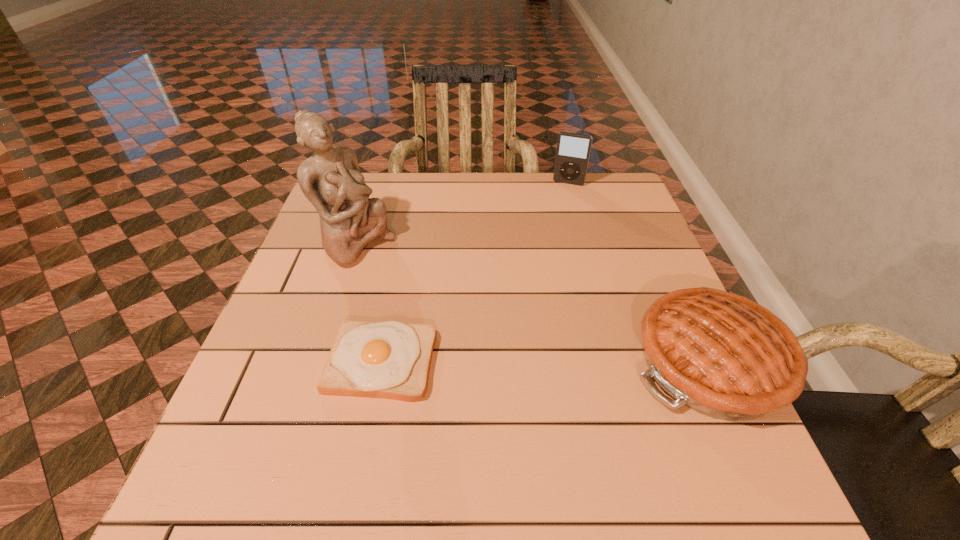
The image size is (960, 540). In order to click on toast in this screenshot , I will do (391, 359).

This screenshot has width=960, height=540. Identify the location of pie. (721, 354).

Locate an element on the screen. The height and width of the screenshot is (540, 960). the third nearest object is located at coordinates (331, 180).

Locate an element on the screen. Image resolution: width=960 pixels, height=540 pixels. figurine is located at coordinates (331, 180).

Locate an element on the screen. Image resolution: width=960 pixels, height=540 pixels. the third shortest object is located at coordinates (573, 150).

Locate an element on the screen. the farthest object is located at coordinates click(573, 150).

Locate an element on the screen. This screenshot has width=960, height=540. free space located 0.370m on the right of the shortest object is located at coordinates (623, 362).

At what (x,y) coordinates should I click in order to perform the action: click on blank space located 0.170m on the left of the third tallest object. Please return your answer as a coordinate pair (x, y). The image size is (960, 540). Looking at the image, I should click on (544, 362).

Find the location of a particular element. Image resolution: width=960 pixels, height=540 pixels. free space located 0.280m on the front-facing side of the figurine is located at coordinates (463, 319).

Image resolution: width=960 pixels, height=540 pixels. In order to click on vacant space located on the front-facing side of the figurine in this screenshot , I will do `click(416, 286)`.